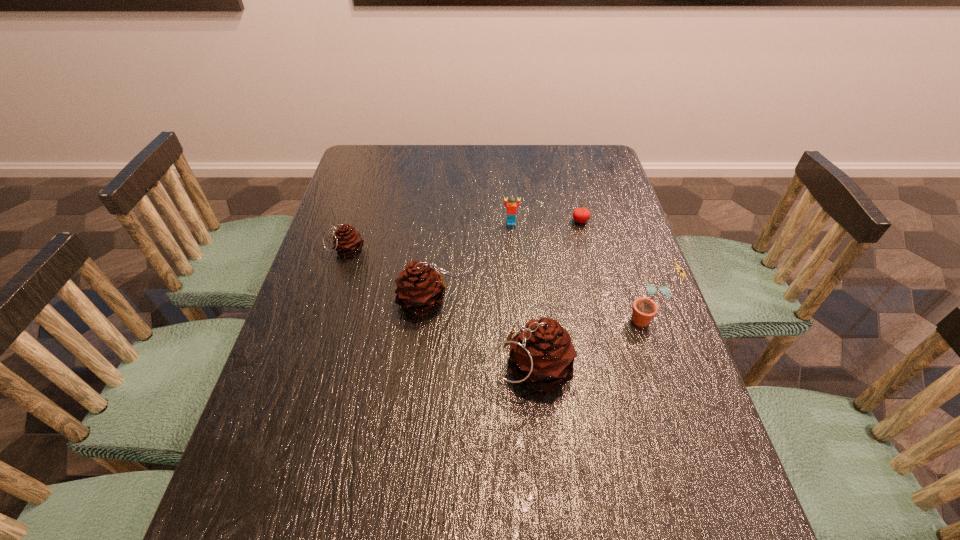
Please point a spot to add another pinecone on the right. Please provide its 2D coordinates. Your answer should be formatted as a tuple, i.e. [(x, y)], where the tuple contains the x and y coordinates of a point satisfying the conditions above.

[(668, 456)]